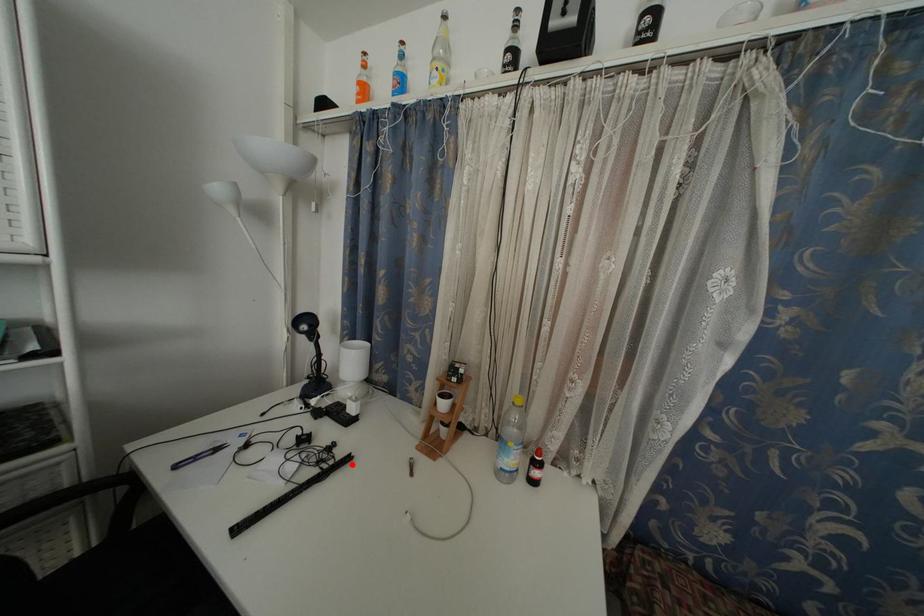
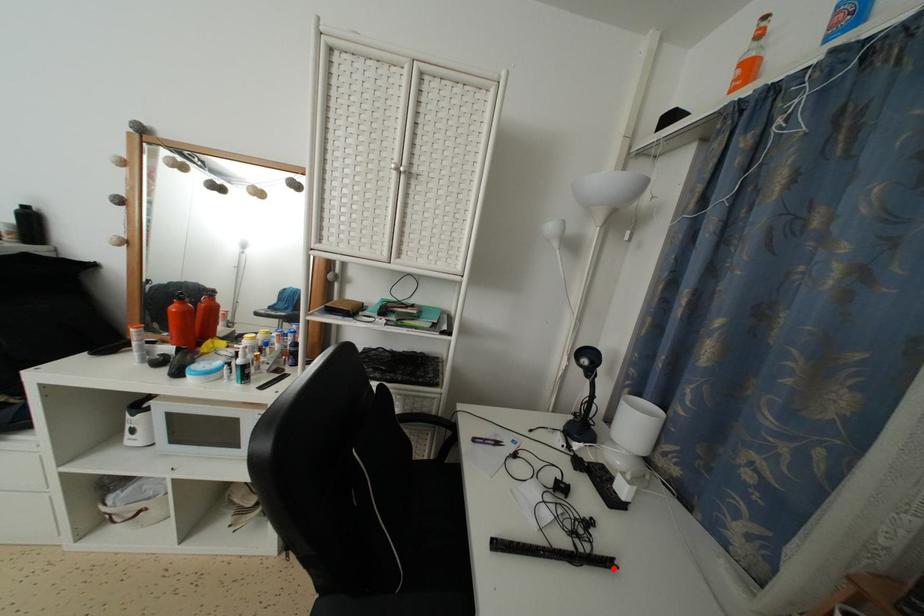
I am providing you with two images of the same scene from different viewpoints. A red point is marked on the first image and another point is marked on the second image. Are the points marked in image1 and image2 representing the same 3D position?

Yes